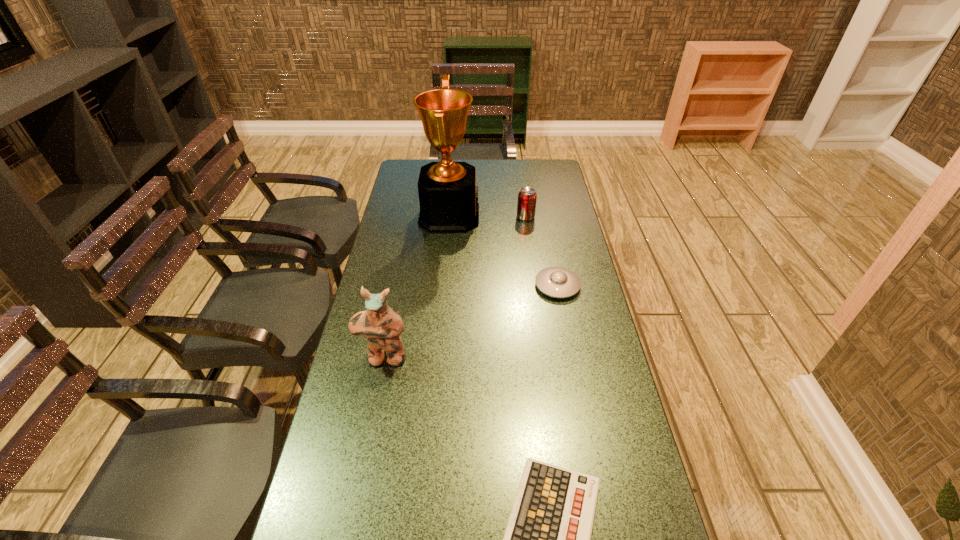
The image size is (960, 540). I want to click on trophy cup present at the left edge, so click(448, 196).

Where is `figurine present at the left edge`? figurine present at the left edge is located at coordinates (381, 325).

The height and width of the screenshot is (540, 960). I want to click on soda can located at the right edge, so click(x=526, y=205).

Image resolution: width=960 pixels, height=540 pixels. In order to click on saucer at the right edge in this screenshot , I will do `click(558, 282)`.

Find the location of `vacant space at the far edge of the desktop`. vacant space at the far edge of the desktop is located at coordinates (459, 160).

In the image, there is a desktop. Find the location of `vacant space at the left edge`. vacant space at the left edge is located at coordinates (391, 428).

The height and width of the screenshot is (540, 960). In order to click on vacant space at the right edge of the desktop in this screenshot , I will do `click(603, 357)`.

The width and height of the screenshot is (960, 540). Find the location of `free space between the fourth tallest object and the trophy cup`. free space between the fourth tallest object and the trophy cup is located at coordinates (503, 251).

Where is `unoccupied area between the trophy cup and the second tallest object`? This screenshot has height=540, width=960. unoccupied area between the trophy cup and the second tallest object is located at coordinates (417, 287).

Locate an element on the screen. The image size is (960, 540). unoccupied area between the third nearest object and the third tallest object is located at coordinates (541, 251).